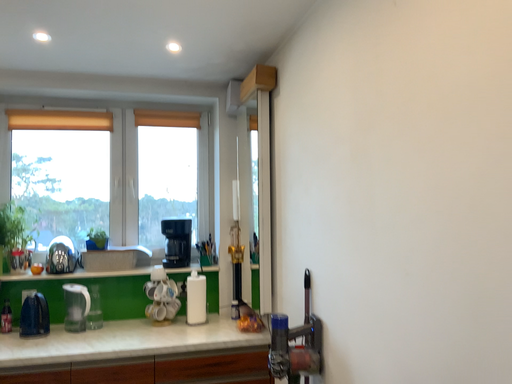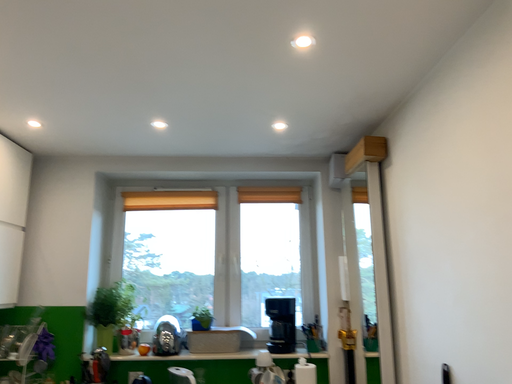
Question: How did the camera likely rotate when shooting the video?

Choices:
 (A) rotated downward
 (B) rotated upward

Answer: (B)